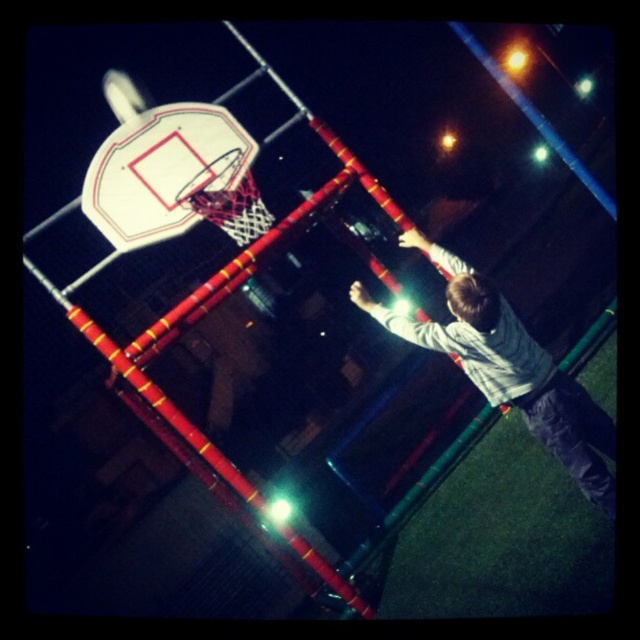
Between light gray sweater at center and white glossy basketball hoop at upper center, which one is positioned lower?

light gray sweater at center is lower down.

Who is more forward, (484, 326) or (100, 200)?

Positioned in front is point (484, 326).

Where is `light gray sweater at center`? The height and width of the screenshot is (640, 640). light gray sweater at center is located at coordinates (509, 369).

Locate an element on the screen. This screenshot has height=640, width=640. light gray sweater at center is located at coordinates (509, 369).